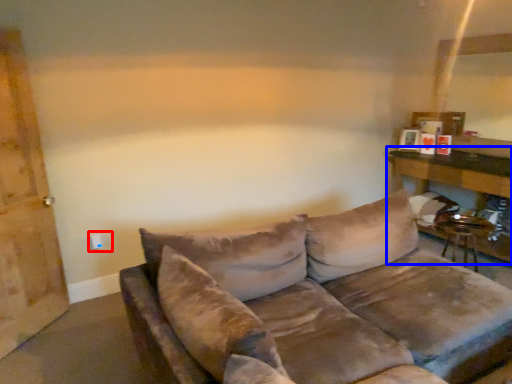
Question: Which point is closer to the camera, electric outlet (highlighted by a red box) or table (highlighted by a blue box)?

Choices:
 (A) electric outlet
 (B) table

Answer: (B)